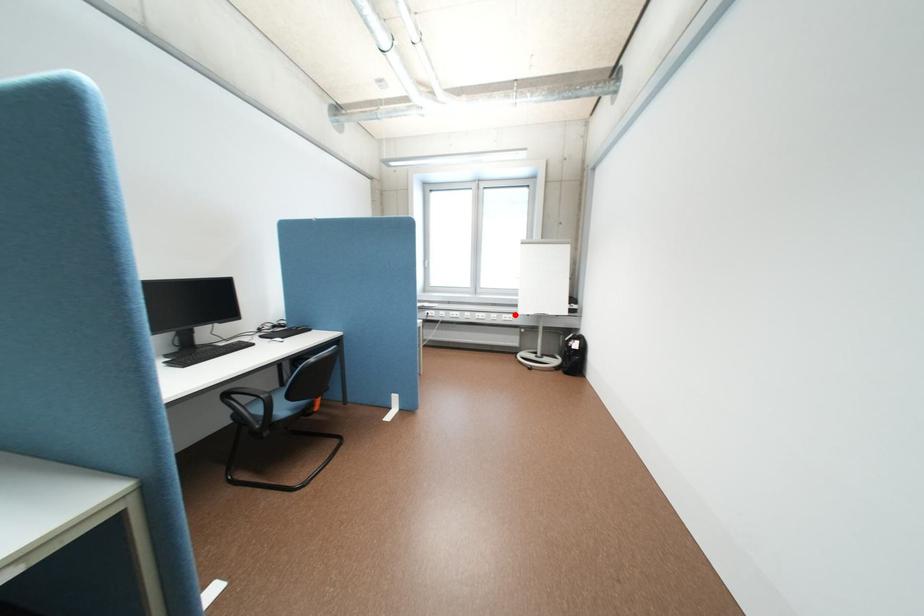
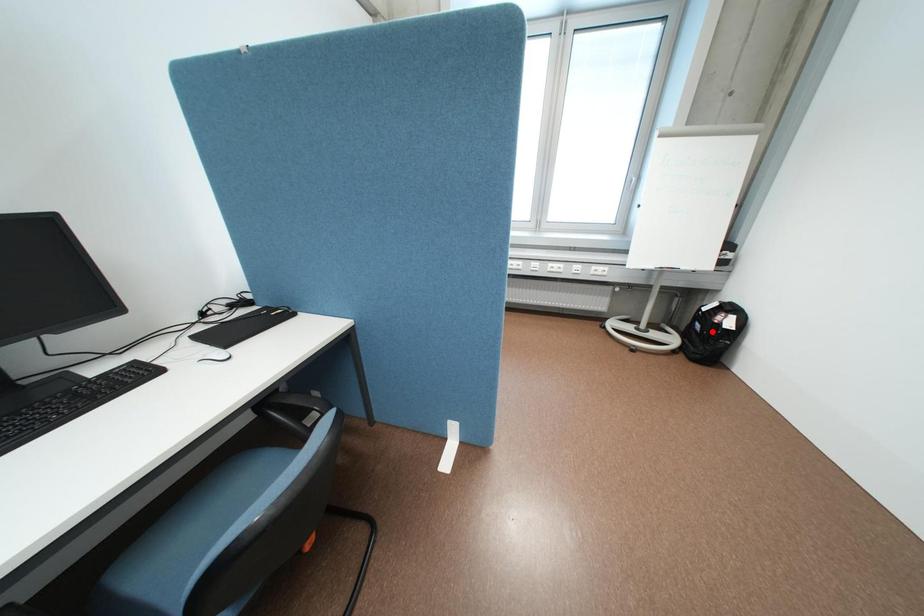
Consider the image. I am providing you with two images of the same scene from different viewpoints. A red point is marked on the first image and another point is marked on the second image. Are the points marked in image1 and image2 representing the same 3D position?

No